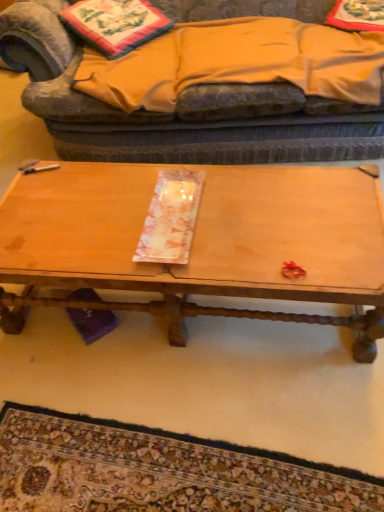
What are the coordinates of `orange cotton blanket at upper center` in the screenshot? It's located at (238, 62).

In order to face velvet fabric studio couch at upper center, should I rotate leftwards or rightwards?

You should look right and rotate roughly 3.826 degrees.

What are the coordinates of `velvet fabric studio couch at upper center` in the screenshot? It's located at (177, 110).

Locate an element on the screen. This screenshot has width=384, height=512. carpet with intricate patterns at lower center is located at coordinates (158, 471).

This screenshot has width=384, height=512. What do you see at coordinates (201, 242) in the screenshot?
I see `wooden tray at center` at bounding box center [201, 242].

This screenshot has width=384, height=512. Identify the location of orange cotton blanket at upper center. (238, 62).

Is orange cotton blanket at upper center inside the boundaries of embroidered fabric pillow at upper left, or outside?

orange cotton blanket at upper center exists outside the volume of embroidered fabric pillow at upper left.

How distant is orange cotton blanket at upper center from embroidered fabric pillow at upper left?

They are 11.66 inches apart.

This screenshot has width=384, height=512. I want to click on blanket below the embroidered fabric pillow at upper left (from a real-world perspective), so click(238, 62).

Looking at this image, between orange cotton blanket at upper center and embroidered fabric pillow at upper left, which one has larger size?

Bigger between the two is orange cotton blanket at upper center.

Does point (292, 140) appear closer or farther from the camera than point (153, 10)?

Point (292, 140) appears to be closer to the viewer than point (153, 10).

Are velvet fabric studio couch at upper center and embroidered fabric pillow at upper left beside each other?

No, velvet fabric studio couch at upper center is not making contact with embroidered fabric pillow at upper left.

From a real-world perspective, is velvet fabric studio couch at upper center located beneath embroidered fabric pillow at upper left?

Correct, in the physical world, velvet fabric studio couch at upper center is lower than embroidered fabric pillow at upper left.

Considering the relative positions of velvet fabric studio couch at upper center and embroidered fabric pillow at upper left in the image provided, is velvet fabric studio couch at upper center to the right of embroidered fabric pillow at upper left from the viewer's perspective?

Indeed, velvet fabric studio couch at upper center is positioned on the right side of embroidered fabric pillow at upper left.

How far apart are wooden tray at center and orange cotton blanket at upper center?

26.52 inches.

Does point (290, 180) come behind point (265, 65)?

No, it is not.

Is wooden tray at center spatially inside orange cotton blanket at upper center, or outside of it?

wooden tray at center is not inside orange cotton blanket at upper center, it's outside.

From a real-world perspective, between wooden tray at center and orange cotton blanket at upper center, who is vertically lower?

wooden tray at center.

Based on their sizes in the image, would you say wooden tray at center is bigger or smaller than carpet with intricate patterns at lower center?

Clearly, wooden tray at center is larger in size than carpet with intricate patterns at lower center.

Does wooden tray at center have a lesser width compared to carpet with intricate patterns at lower center?

Incorrect, the width of wooden tray at center is not less than that of carpet with intricate patterns at lower center.

From the image's perspective, which is above, wooden tray at center or carpet with intricate patterns at lower center?

wooden tray at center, from the image's perspective.

Which point is more forward, [55,176] or [203,464]?

The point [203,464] is closer to the camera.

Between embroidered fabric pillow at upper left and carpet with intricate patterns at lower center, which one appears on the left side from the viewer's perspective?

From the viewer's perspective, embroidered fabric pillow at upper left appears more on the left side.

Is embroidered fabric pillow at upper left turned away from carpet with intricate patterns at lower center?

embroidered fabric pillow at upper left does not have its back to carpet with intricate patterns at lower center.

From the image's perspective, is embroidered fabric pillow at upper left over carpet with intricate patterns at lower center?

Yes, from the image's perspective, embroidered fabric pillow at upper left is on top of carpet with intricate patterns at lower center.

From a real-world perspective, is embroidered fabric pillow at upper left physically located above or below carpet with intricate patterns at lower center?

From a real-world perspective, embroidered fabric pillow at upper left is physically above carpet with intricate patterns at lower center.

From the picture: Considering the sizes of velvet fabric studio couch at upper center and carpet with intricate patterns at lower center in the image, is velvet fabric studio couch at upper center taller or shorter than carpet with intricate patterns at lower center?

velvet fabric studio couch at upper center is taller than carpet with intricate patterns at lower center.

Is velvet fabric studio couch at upper center next to carpet with intricate patterns at lower center?

No, velvet fabric studio couch at upper center is not beside carpet with intricate patterns at lower center.

In the scene shown: Is carpet with intricate patterns at lower center a part of velvet fabric studio couch at upper center?

No, velvet fabric studio couch at upper center does not contain carpet with intricate patterns at lower center.

Is point (172, 119) more distant than point (369, 478)?

Yes, it is behind point (369, 478).

Which is correct: embroidered fabric pillow at upper left is inside velvet fabric studio couch at upper center, or outside of it?

embroidered fabric pillow at upper left exists entirely within velvet fabric studio couch at upper center.

From a real-world perspective, which is physically above, embroidered fabric pillow at upper left or velvet fabric studio couch at upper center?

In real-world perspective, embroidered fabric pillow at upper left is above.

In the scene shown: Which is more to the left, embroidered fabric pillow at upper left or velvet fabric studio couch at upper center?

embroidered fabric pillow at upper left.

Is embroidered fabric pillow at upper left oriented away from velvet fabric studio couch at upper center?

Yes.

I want to click on pillow positioned vertically above the orange cotton blanket at upper center (from a real-world perspective), so click(115, 24).

Locate an element on the screen. This screenshot has width=384, height=512. pillow behind the velvet fabric studio couch at upper center is located at coordinates (115, 24).

Looking at the image, which one is located further to carpet with intricate patterns at lower center, embroidered fabric pillow at upper left or velvet fabric studio couch at upper center?

The object further to carpet with intricate patterns at lower center is embroidered fabric pillow at upper left.

When comparing their distances from carpet with intricate patterns at lower center, does embroidered fabric pillow at upper left or orange cotton blanket at upper center seem closer?

The object closer to carpet with intricate patterns at lower center is orange cotton blanket at upper center.

Considering their positions, is embroidered fabric pillow at upper left positioned further to velvet fabric studio couch at upper center than orange cotton blanket at upper center?

embroidered fabric pillow at upper left is positioned further to the anchor velvet fabric studio couch at upper center.

Estimate the real-world distances between objects in this image. Which object is further from orange cotton blanket at upper center, velvet fabric studio couch at upper center or embroidered fabric pillow at upper left?

Based on the image, embroidered fabric pillow at upper left appears to be further to orange cotton blanket at upper center.

Looking at the image, which one is located further to velvet fabric studio couch at upper center, wooden tray at center or orange cotton blanket at upper center?

Based on the image, wooden tray at center appears to be further to velvet fabric studio couch at upper center.

From the image, which object appears to be nearer to wooden tray at center, embroidered fabric pillow at upper left or orange cotton blanket at upper center?

orange cotton blanket at upper center is positioned closer to the anchor wooden tray at center.

Estimate the real-world distances between objects in this image. Which object is further from wooden tray at center, orange cotton blanket at upper center or embroidered fabric pillow at upper left?

Based on the image, embroidered fabric pillow at upper left appears to be further to wooden tray at center.

Considering their positions, is velvet fabric studio couch at upper center positioned further to orange cotton blanket at upper center than carpet with intricate patterns at lower center?

Based on the image, carpet with intricate patterns at lower center appears to be further to orange cotton blanket at upper center.

Where is `blanket between embroidered fabric pillow at upper left and carpet with intricate patterns at lower center from top to bottom`? Image resolution: width=384 pixels, height=512 pixels. blanket between embroidered fabric pillow at upper left and carpet with intricate patterns at lower center from top to bottom is located at coordinates (238, 62).

Identify the location of blanket that lies between embroidered fabric pillow at upper left and wooden tray at center from top to bottom. (238, 62).

Identify the location of coffee table between orange cotton blanket at upper center and carpet with intricate patterns at lower center from top to bottom. The width and height of the screenshot is (384, 512). (201, 242).

I want to click on studio couch between embroidered fabric pillow at upper left and wooden tray at center in the up-down direction, so click(177, 110).